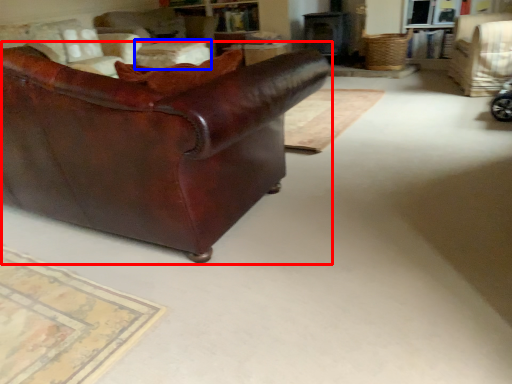
Question: Which point is closer to the camera, studio couch (highlighted by a red box) or table (highlighted by a blue box)?

Choices:
 (A) studio couch
 (B) table

Answer: (A)